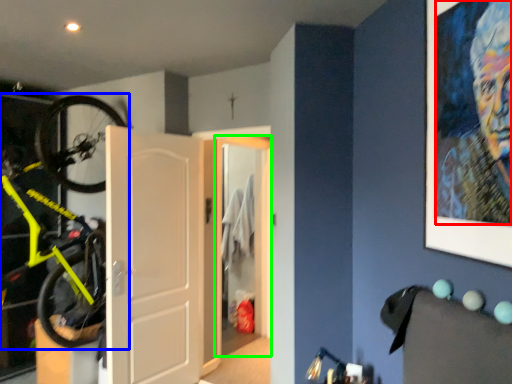
Question: Which object is the farthest from person (highlighted by a red box)? Choose among these: bicycle (highlighted by a blue box) or door (highlighted by a green box).

Choices:
 (A) bicycle
 (B) door

Answer: (B)